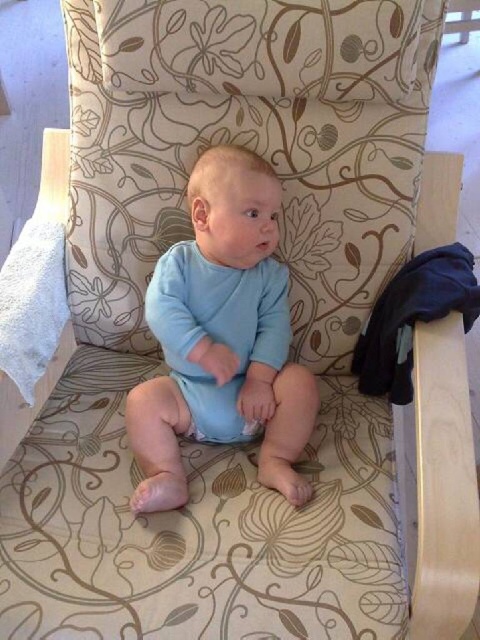
Between smooth blue onesie at center and blue soft diaper at center, which one appears on the left side from the viewer's perspective?

From the viewer's perspective, blue soft diaper at center appears more on the left side.

Is smooth blue onesie at center to the left of blue soft diaper at center from the viewer's perspective?

Incorrect, smooth blue onesie at center is not on the left side of blue soft diaper at center.

Is point (263, 241) more distant than point (238, 420)?

No, it is in front of (238, 420).

The height and width of the screenshot is (640, 480). In order to click on smooth blue onesie at center in this screenshot , I will do `click(223, 337)`.